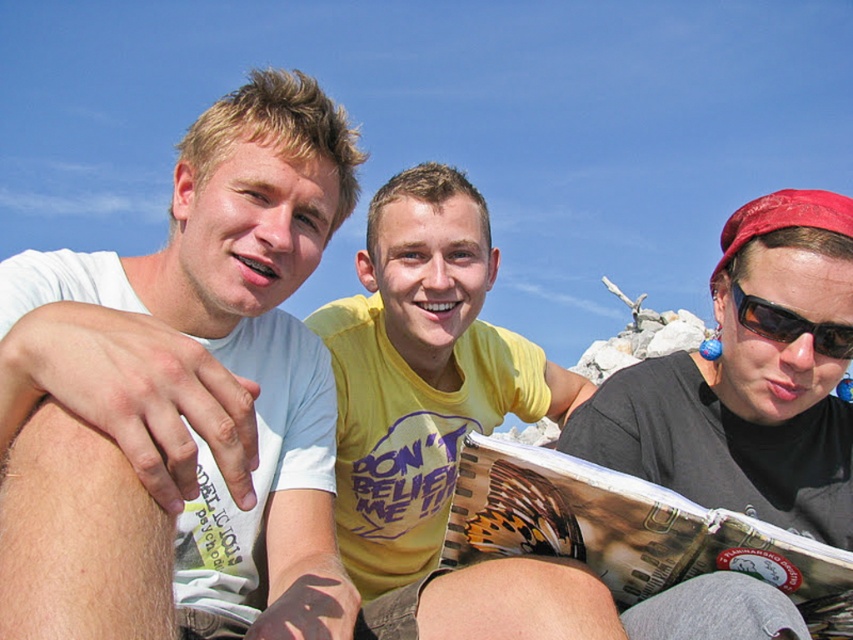
Which of these two, printed paper magazine at center or black plastic sunglasses at right, stands shorter?

printed paper magazine at center

Is point (593, 504) in front of point (798, 330)?

Yes, it is in front of point (798, 330).

Locate an element on the screen. The width and height of the screenshot is (853, 640). printed paper magazine at center is located at coordinates (630, 531).

Is matte black sunglasses at upper right closer to camera compared to black plastic sunglasses at right?

Yes, it is.

The image size is (853, 640). In order to click on matte black sunglasses at upper right in this screenshot , I will do `click(749, 380)`.

In order to click on matte black sunglasses at upper right in this screenshot , I will do `click(749, 380)`.

Does white matte t-shirt at left come in front of printed paper magazine at center?

Yes, it is.

The height and width of the screenshot is (640, 853). What do you see at coordinates (184, 397) in the screenshot?
I see `white matte t-shirt at left` at bounding box center [184, 397].

Is point (289, 513) positioned behind point (741, 516)?

Yes, it is behind point (741, 516).

Image resolution: width=853 pixels, height=640 pixels. Find the location of `white matte t-shirt at left`. white matte t-shirt at left is located at coordinates (184, 397).